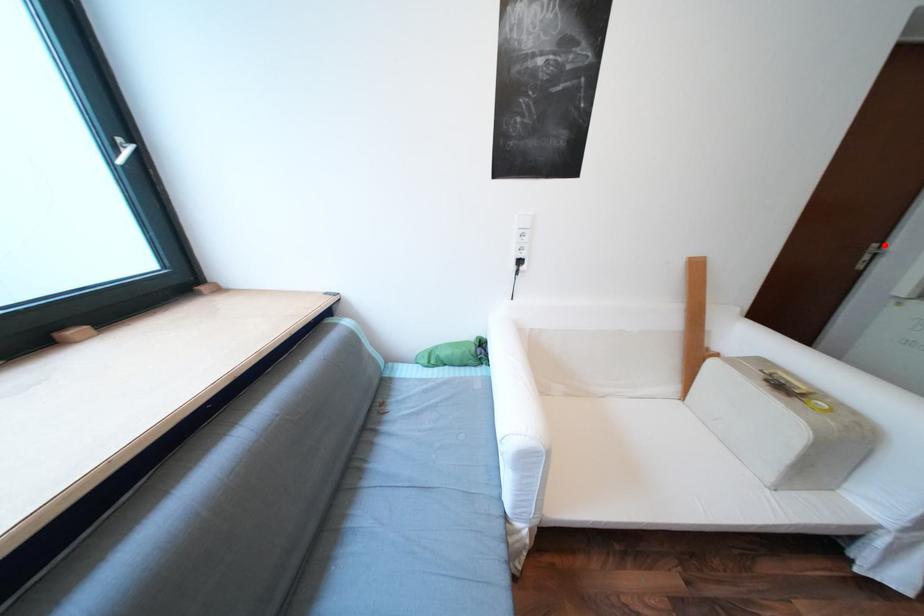
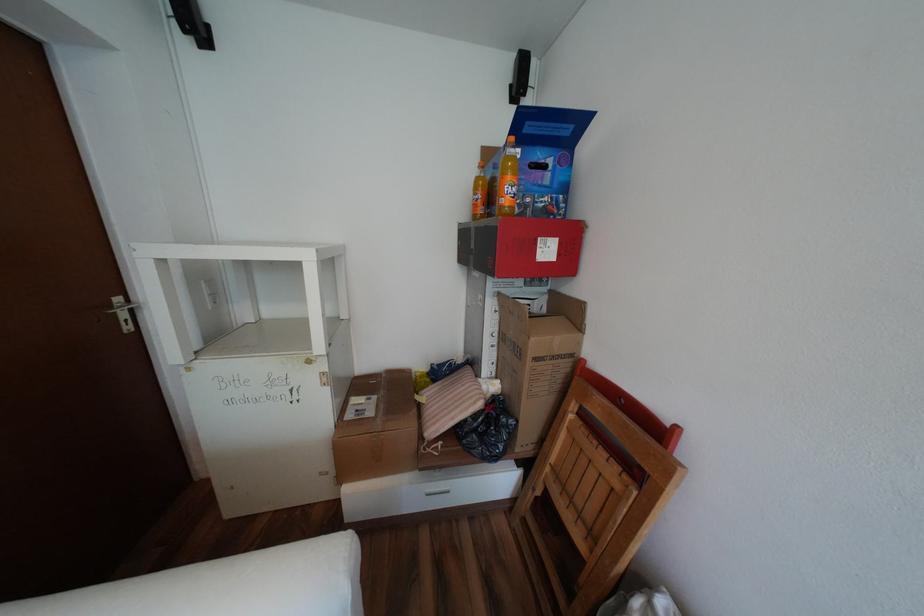
Where in the second image is the point corresponding to the highlighted location from the first image?

(128, 299)